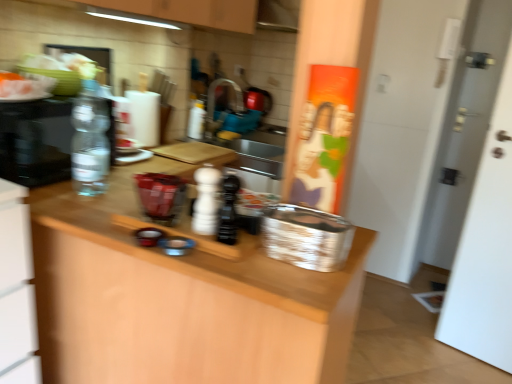
The image size is (512, 384). Identify the location of vacant space situated on the left part of silver metallic basket at center. (226, 244).